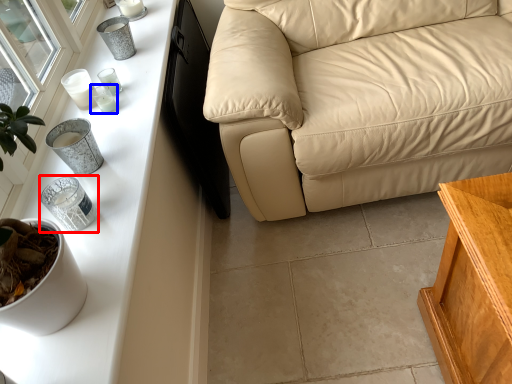
Question: Among these objects, which one is nearest to the camera, candle holder (highlighted by a red box) or candle holder (highlighted by a blue box)?

Choices:
 (A) candle holder
 (B) candle holder

Answer: (A)